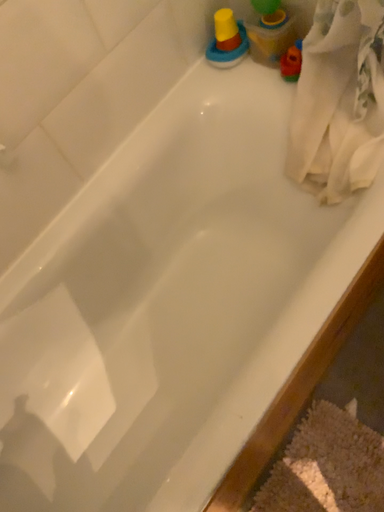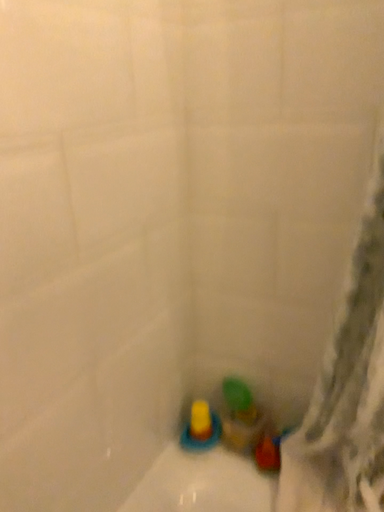
Question: How did the camera likely rotate when shooting the video?

Choices:
 (A) rotated right
 (B) rotated left

Answer: (A)